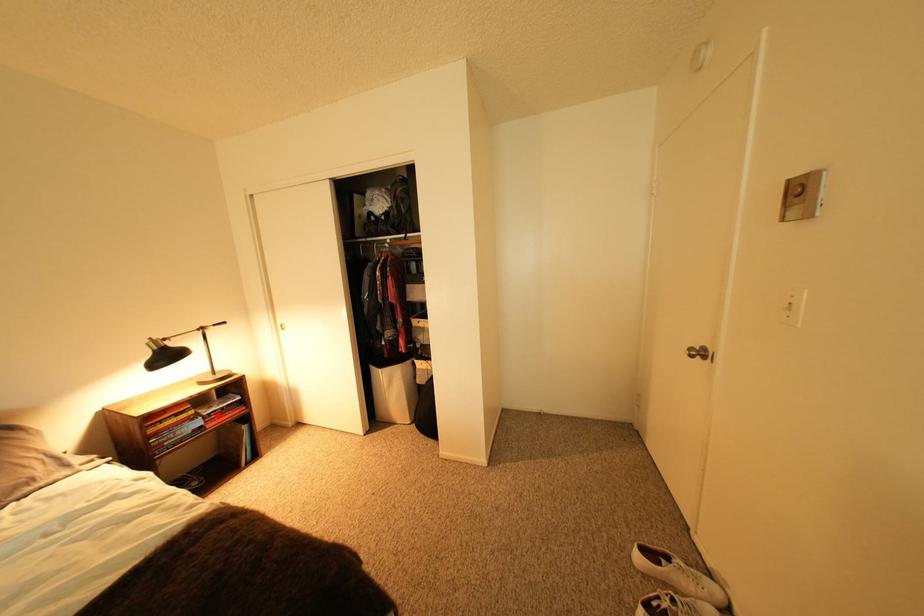
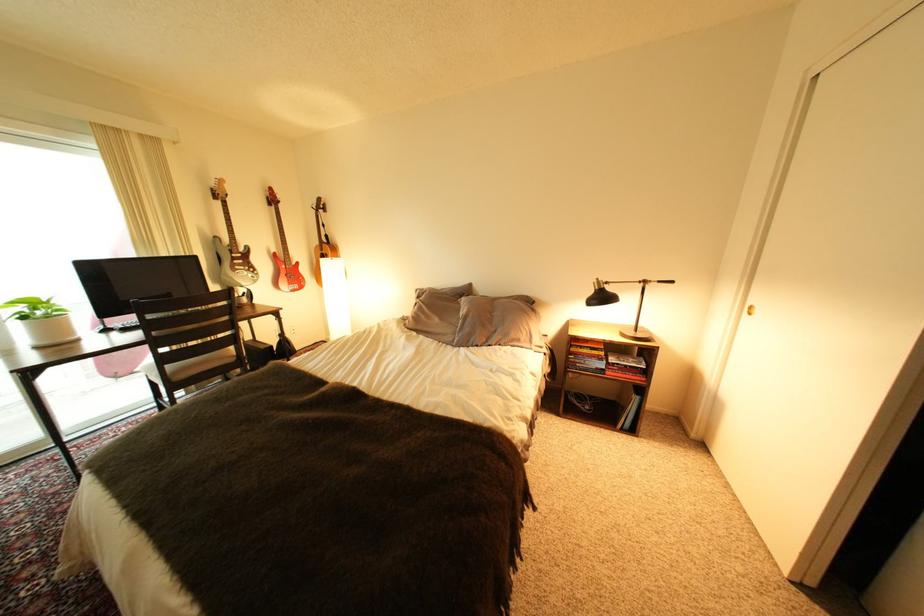
Where in the second image is the point corresponding to the highlighted location from the first image?

(623, 363)